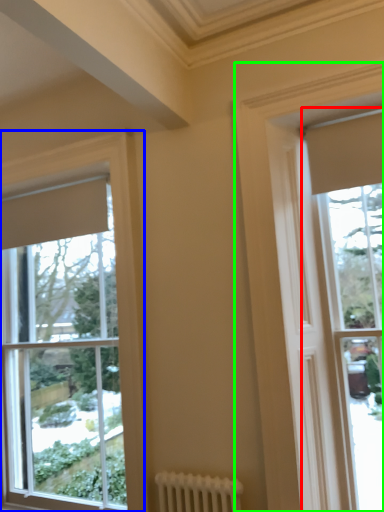
Question: Which object is the closest to the window (highlighted by a red box)? Choose among these: window (highlighted by a blue box) or window (highlighted by a green box).

Choices:
 (A) window
 (B) window

Answer: (B)